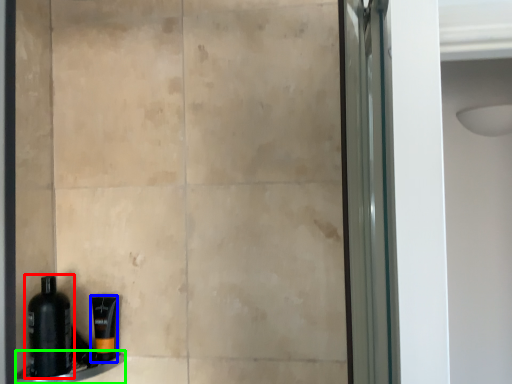
Question: Considering the real-world distances, which object is closest to bottle (highlighted by a red box)? toiletry (highlighted by a blue box) or ledge (highlighted by a green box).

Choices:
 (A) toiletry
 (B) ledge

Answer: (B)